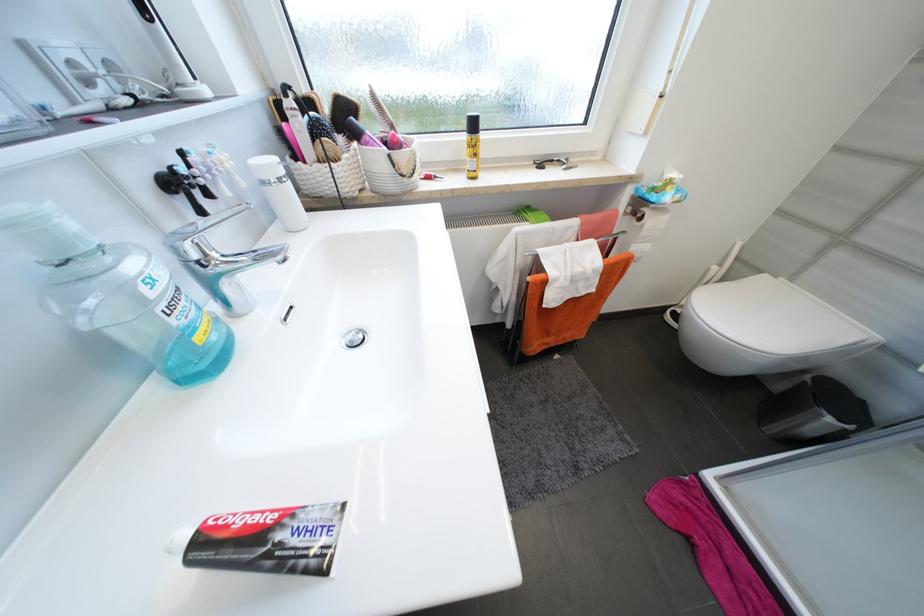
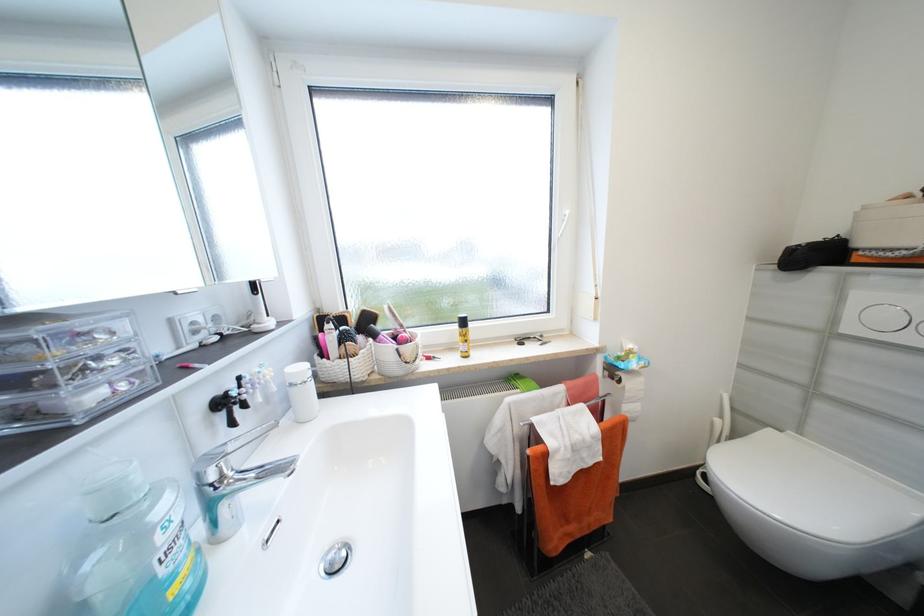
Question: How did the camera likely rotate?

Choices:
 (A) Left
 (B) Right
 (C) Up
 (D) Down

Answer: (C)